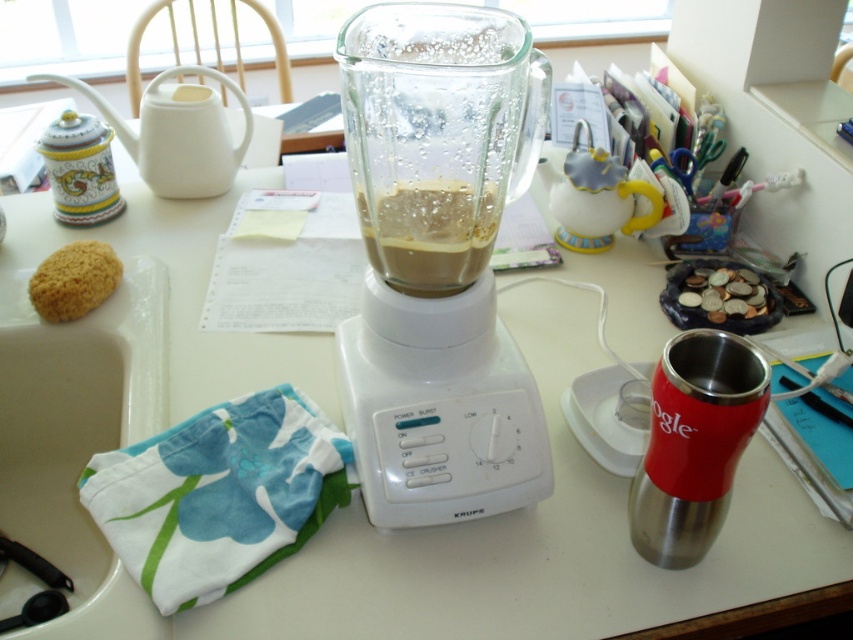
You are a robot trying to pick up an object located at point [453,240] and another at point [106,264]. Which point should you reach first to minimize travel distance?

Point [453,240] is closer to the viewer than point [106,264], so you should reach point [453,240] first to minimize travel distance.

You are organizing the kitchen counter and need to move the white plastic blender at center to the sink on the left. However, there is a stainless steel thermos at right in the way. Can you slide the blender to the left without moving the thermos?

The white plastic blender at center is positioned over the stainless steel thermos at right, meaning the blender is directly above the thermos. Since they are stacked vertically, sliding the blender to the left would require moving the thermos first to create space.